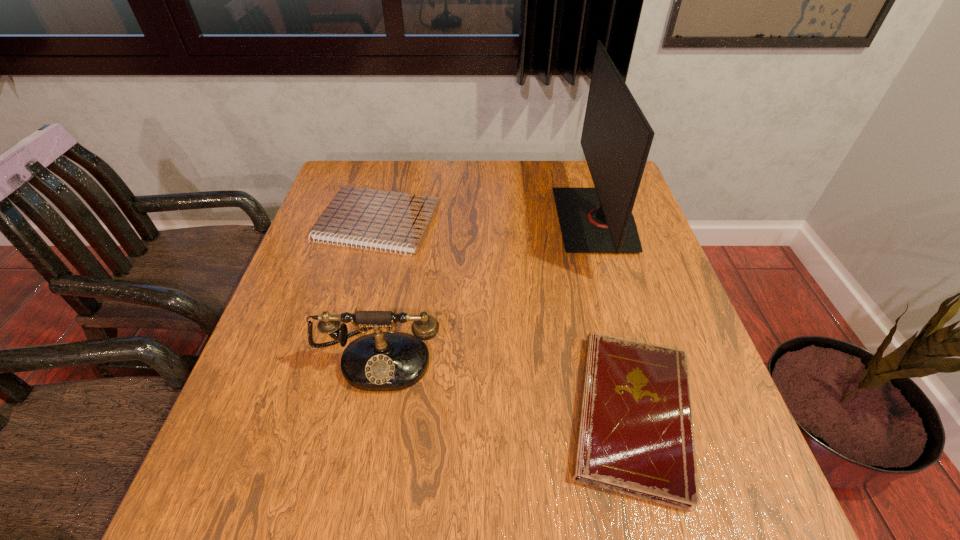
I want to click on free spot between the right notebook and the second tallest object, so click(506, 384).

You are a GUI agent. You are given a task and a screenshot of the screen. Output one action in this format:
    pyautogui.click(x=<x>, y=<y>)
    Task: Click on the vacant point located between the tallest object and the farther notebook
    The height and width of the screenshot is (540, 960).
    Given the screenshot: What is the action you would take?
    pyautogui.click(x=487, y=222)

I want to click on empty location between the left notebook and the telephone, so click(378, 289).

Select which object appears as the third closest to the second tallest object. Please provide its 2D coordinates. Your answer should be formatted as a tuple, i.e. [(x, y)], where the tuple contains the x and y coordinates of a point satisfying the conditions above.

[(616, 138)]

This screenshot has height=540, width=960. Find the location of `object that stands as the closest to the right notebook`. object that stands as the closest to the right notebook is located at coordinates (616, 138).

At what (x,y) coordinates should I click in order to perform the action: click on vacant space that satisfies the following two spatial constraints: 1. on the screen side of the monitor; 2. on the dial of the third shortest object. Please return your answer as a coordinate pair (x, y). The image size is (960, 540). Looking at the image, I should click on (636, 355).

Where is `free space in the image that satisfies the following two spatial constraints: 1. on the screen side of the tallest object; 2. on the front side of the right notebook`? free space in the image that satisfies the following two spatial constraints: 1. on the screen side of the tallest object; 2. on the front side of the right notebook is located at coordinates (653, 414).

Find the location of a particular element. The image size is (960, 540). free space that satisfies the following two spatial constraints: 1. on the screen side of the monitor; 2. on the front side of the right notebook is located at coordinates (653, 414).

You are a GUI agent. You are given a task and a screenshot of the screen. Output one action in this format:
    pyautogui.click(x=<x>, y=<y>)
    Task: Click on the free location that satisfies the following two spatial constraints: 1. on the screen side of the tallest object; 2. on the dial of the second tallest object
    This screenshot has width=960, height=540.
    Given the screenshot: What is the action you would take?
    pyautogui.click(x=636, y=355)

Identify the location of vacant position in the image that satisfies the following two spatial constraints: 1. on the screen side of the tallest object; 2. on the dial of the third shortest object. The image size is (960, 540). (636, 355).